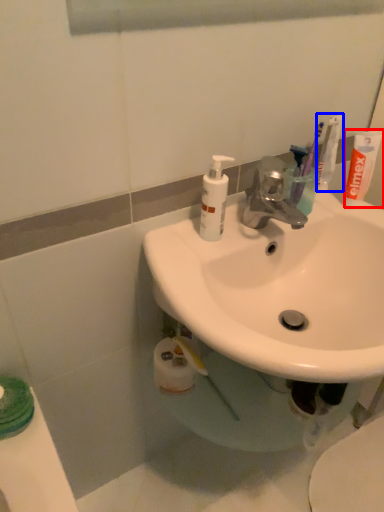
Question: Among these objects, which one is farthest to the camera, toothpaste (highlighted by a red box) or toothbrush (highlighted by a blue box)?

Choices:
 (A) toothpaste
 (B) toothbrush

Answer: (B)